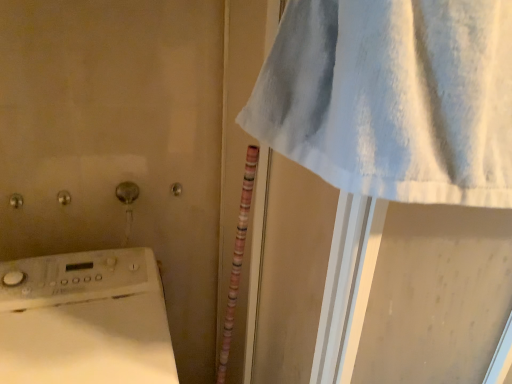
Measure the distance between point (25, 368) and camera.

Point (25, 368) and camera are 29.53 inches apart.

What do you see at coordinates (85, 320) in the screenshot? I see `white matte washing machine at lower left` at bounding box center [85, 320].

You are a GUI agent. You are given a task and a screenshot of the screen. Output one action in this format:
    pyautogui.click(x=<x>, y=<y>)
    Task: Click on the white matte washing machine at lower left
    
    Given the screenshot: What is the action you would take?
    pyautogui.click(x=85, y=320)

Where is `white matte washing machine at lower left`? white matte washing machine at lower left is located at coordinates (85, 320).